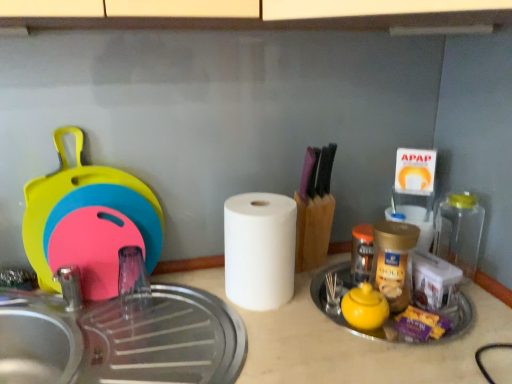
Locate an element on the screen. Image resolution: width=512 pixels, height=384 pixels. free location in front of golden plastic jar at center-right, the second bottle from the left is located at coordinates pos(431,332).